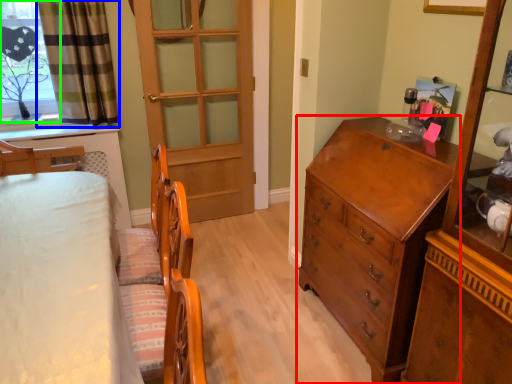
Question: Estimate the real-world distances between objects in this image. Which object is closer to chest of drawers (highlighted by a red box), curtain (highlighted by a blue box) or window (highlighted by a green box)?

Choices:
 (A) curtain
 (B) window

Answer: (A)